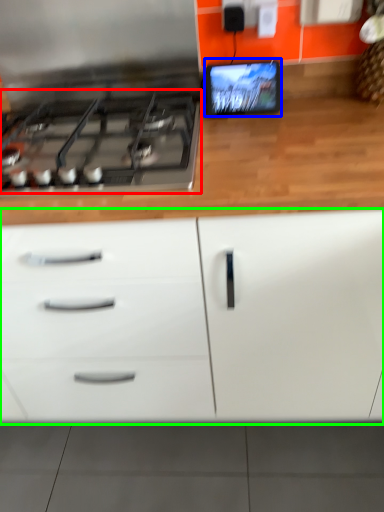
Question: Which object is the farthest from gas stove (highlighted by a red box)? Choose among these: computer monitor (highlighted by a blue box) or cabinetry (highlighted by a green box).

Choices:
 (A) computer monitor
 (B) cabinetry

Answer: (B)